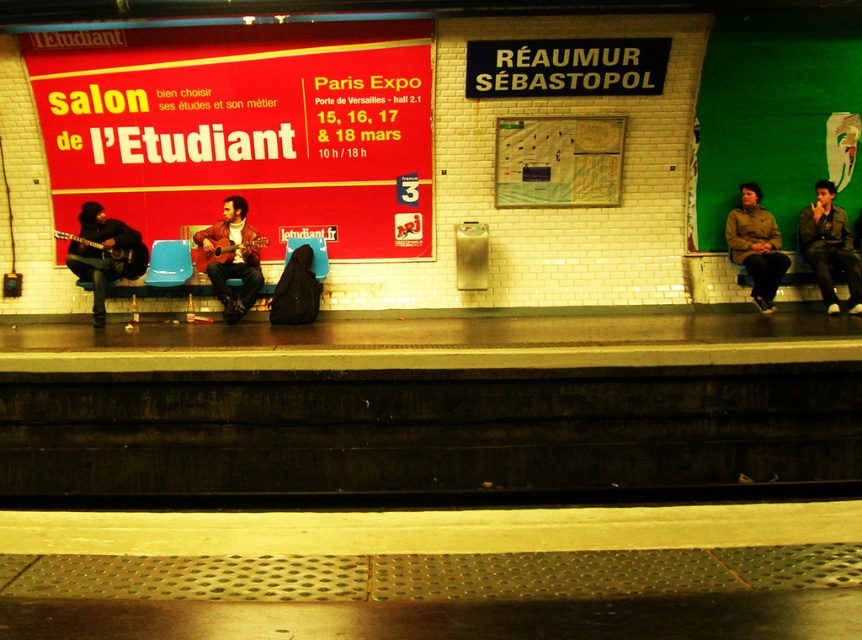
Looking at this image, you are a commuter on the subway platform at Reaumur Sebastopol. You see a brown leather jacket at right and a leather jacket at center. Which jacket is more likely to fit into a narrow coat hanger?

The brown leather jacket at right is thinner than the leather jacket at center, so it is more likely to fit into a narrow coat hanger.

You are a delivery person who needs to place a box between the red matte poster at center and the green matte jacket at right. Can you fit the box there if the box is 1.2 meters wide?

The red matte poster at center is wider than the green matte jacket at right. Since the box is 1.2 meters wide, it depends on the actual width difference between the two objects. However, without specific measurements, we cannot confirm if the space between them is sufficient.